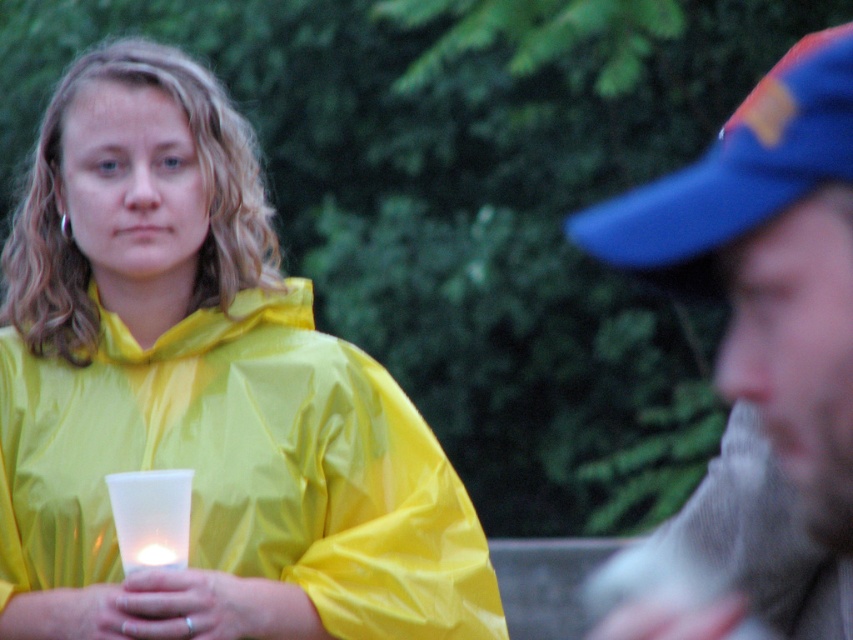
You are standing in the middle of the image. The blue fabric cap at upper right is located at point (761, 352). If you want to move towards the blue fabric cap at upper right, which direction should you move in terms of the image coordinate system?

The blue fabric cap at upper right is located at point (761, 352). In the image coordinate system, moving towards the blue fabric cap at upper right would require moving right and up since the x coordinate increases to the right and the y coordinate increases downward. However, since the point is at upper right, the y value is lower. Therefore, you should move towards the upper right direction in the image.